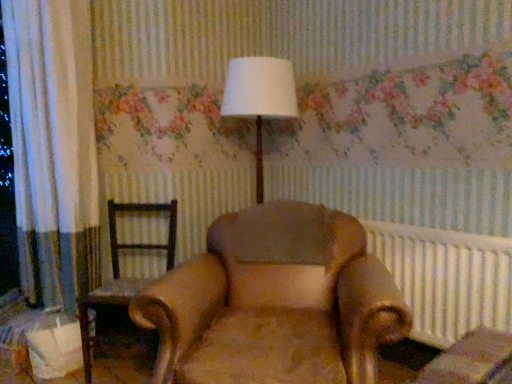
Question: Does leather armchair at center, the second chair viewed from the left, have a greater height compared to brown leather chair at left, placed as the second chair when sorted from right to left?

Choices:
 (A) yes
 (B) no

Answer: (A)

Question: Is leather armchair at center, the second chair viewed from the left, positioned with its back to brown leather chair at left, placed as the second chair when sorted from right to left?

Choices:
 (A) no
 (B) yes

Answer: (A)

Question: From the image's perspective, would you say leather armchair at center, the first chair when ordered from right to left, is shown under brown leather chair at left, positioned as the 1th chair in left-to-right order?

Choices:
 (A) no
 (B) yes

Answer: (B)

Question: Does leather armchair at center, the second chair viewed from the left, have a larger size compared to brown leather chair at left, placed as the second chair when sorted from right to left?

Choices:
 (A) yes
 (B) no

Answer: (A)

Question: Is leather armchair at center, the second chair viewed from the left, touching brown leather chair at left, positioned as the 1th chair in left-to-right order?

Choices:
 (A) yes
 (B) no

Answer: (B)

Question: Considering the positions of point (176, 225) and point (228, 107), is point (176, 225) closer or farther from the camera than point (228, 107)?

Choices:
 (A) farther
 (B) closer

Answer: (A)

Question: From a real-world perspective, is brown leather chair at left, positioned as the 1th chair in left-to-right order, physically located above or below white fabric lampshade at center?

Choices:
 (A) below
 (B) above

Answer: (A)

Question: Is brown leather chair at left, placed as the second chair when sorted from right to left, wider or thinner than white fabric lampshade at center?

Choices:
 (A) thin
 (B) wide

Answer: (B)

Question: Visually, is brown leather chair at left, placed as the second chair when sorted from right to left, positioned to the left or to the right of white fabric lampshade at center?

Choices:
 (A) left
 (B) right

Answer: (A)

Question: From their relative heights in the image, would you say white plastic radiator at right is taller or shorter than leather armchair at center, the first chair when ordered from right to left?

Choices:
 (A) tall
 (B) short

Answer: (B)

Question: Looking at the image, does white plastic radiator at right seem bigger or smaller compared to leather armchair at center, the second chair viewed from the left?

Choices:
 (A) big
 (B) small

Answer: (B)

Question: Is white plastic radiator at right inside the boundaries of leather armchair at center, the second chair viewed from the left, or outside?

Choices:
 (A) outside
 (B) inside

Answer: (A)

Question: In terms of width, does white plastic radiator at right look wider or thinner when compared to leather armchair at center, the first chair when ordered from right to left?

Choices:
 (A) wide
 (B) thin

Answer: (B)

Question: Does point pos(138,248) appear closer or farther from the camera than point pos(459,256)?

Choices:
 (A) farther
 (B) closer

Answer: (A)

Question: From a real-world perspective, relative to white plastic radiator at right, is brown leather chair at left, positioned as the 1th chair in left-to-right order, vertically above or below?

Choices:
 (A) above
 (B) below

Answer: (B)